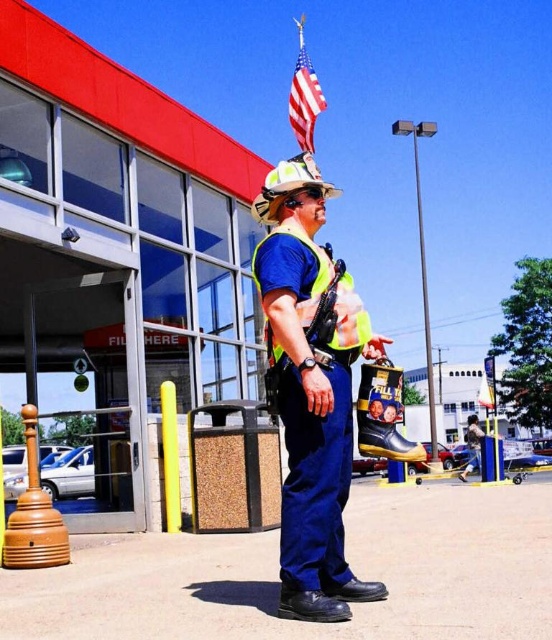
You are a delivery driver who needs to locate the red fabric flag at upper center. According to the scene, where exactly would you find it?

The red fabric flag at upper center is located at point (x=304, y=97).